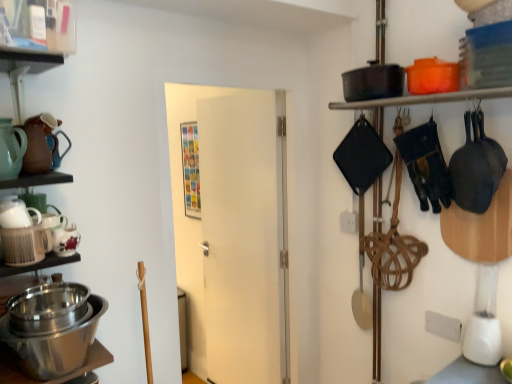
Describe the element at coordinates (425, 99) in the screenshot. Image resolution: width=512 pixels, height=384 pixels. I see `matte black pot at upper right, which is counted as the 2th shelf, starting from the top` at that location.

Where is `white plastic blender at right`? The width and height of the screenshot is (512, 384). white plastic blender at right is located at coordinates (484, 320).

Image resolution: width=512 pixels, height=384 pixels. What do you see at coordinates (232, 230) in the screenshot? I see `white matte door at center` at bounding box center [232, 230].

The width and height of the screenshot is (512, 384). What are the coordinates of `white matte door at center` in the screenshot? It's located at 232,230.

This screenshot has width=512, height=384. Describe the element at coordinates (11, 149) in the screenshot. I see `matte ceramic teapot at left, arranged as the 2th tea pot when viewed from the top` at that location.

You are a GUI agent. You are given a task and a screenshot of the screen. Output one action in this format:
    pyautogui.click(x=<x>, y=<y>)
    Task: Click on the ceramic tea pot at lower left, marked as the first tea pot in a bottom-to-top arrangement
    
    Given the screenshot: What is the action you would take?
    pyautogui.click(x=65, y=240)

From a real-world perspective, is clear plastic container at upper left, which is the 2th shelf in bottom-to-top order, physically located above or below ceramic tea pot at lower left, the 4th tea pot from the top?

clear plastic container at upper left, which is the 2th shelf in bottom-to-top order, is above ceramic tea pot at lower left, the 4th tea pot from the top.

This screenshot has height=384, width=512. I want to click on the 4th tea pot below the clear plastic container at upper left, the 1th shelf viewed from the left (from a real-world perspective), so click(x=65, y=240).

Looking at this image, which is correct: clear plastic container at upper left, arranged as the second shelf when viewed from the back, is inside ceramic tea pot at lower left, marked as the first tea pot in a bottom-to-top arrangement, or outside of it?

clear plastic container at upper left, arranged as the second shelf when viewed from the back, lies outside ceramic tea pot at lower left, marked as the first tea pot in a bottom-to-top arrangement.

Looking at this image, considering their positions, is clear plastic container at upper left, which ranks as the 2th shelf in right-to-left order, located in front of or behind ceramic tea pot at lower left, the 4th tea pot from the top?

clear plastic container at upper left, which ranks as the 2th shelf in right-to-left order, is positioned closer to the viewer than ceramic tea pot at lower left, the 4th tea pot from the top.

From the image's perspective, count 2nd tea pots downward from the matte brown teapot at upper left, which appears as the first tea pot when viewed from the top, and point to it. Please provide its 2D coordinates.

[(16, 213)]

Choose the correct answer: Is matte brown teapot at upper left, positioned as the 4th tea pot in bottom-to-top order, inside white matte tea pot at left, which appears as the 2th tea pot when ordered from the bottom, or outside it?

The correct answer is: outside.

Are matte brown teapot at upper left, which appears as the first tea pot when viewed from the top, and white matte tea pot at left, which ranks as the third tea pot in top-to-bottom order, located far from each other?

Actually, matte brown teapot at upper left, which appears as the first tea pot when viewed from the top, and white matte tea pot at left, which ranks as the third tea pot in top-to-bottom order, are a little close together.

From a real-world perspective, is matte brown teapot at upper left, positioned as the 4th tea pot in bottom-to-top order, beneath white matte tea pot at left, which appears as the 2th tea pot when ordered from the bottom?

No, from a real-world perspective, matte brown teapot at upper left, positioned as the 4th tea pot in bottom-to-top order, is not beneath white matte tea pot at left, which appears as the 2th tea pot when ordered from the bottom.

Is white matte tea pot at left, which ranks as the third tea pot in top-to-bottom order, oriented towards matte brown teapot at upper left, positioned as the 4th tea pot in bottom-to-top order?

No, white matte tea pot at left, which ranks as the third tea pot in top-to-bottom order, is not facing towards matte brown teapot at upper left, positioned as the 4th tea pot in bottom-to-top order.

Is white matte tea pot at left, which ranks as the third tea pot in top-to-bottom order, beside matte brown teapot at upper left, positioned as the 4th tea pot in bottom-to-top order?

No, white matte tea pot at left, which ranks as the third tea pot in top-to-bottom order, is not beside matte brown teapot at upper left, positioned as the 4th tea pot in bottom-to-top order.

Is white matte tea pot at left, which ranks as the third tea pot in top-to-bottom order, further to the viewer compared to matte brown teapot at upper left, which appears as the first tea pot when viewed from the top?

No, the depth of white matte tea pot at left, which ranks as the third tea pot in top-to-bottom order, is less than that of matte brown teapot at upper left, which appears as the first tea pot when viewed from the top.

In the scene shown: Considering the sizes of objects ceramic tea pot at lower left, marked as the first tea pot in a bottom-to-top arrangement, and matte black pot at upper right, which is counted as the first shelf, starting from the right, in the image provided, who is taller, ceramic tea pot at lower left, marked as the first tea pot in a bottom-to-top arrangement, or matte black pot at upper right, which is counted as the first shelf, starting from the right,?

ceramic tea pot at lower left, marked as the first tea pot in a bottom-to-top arrangement, is taller.

Considering the sizes of objects ceramic tea pot at lower left, the 4th tea pot from the top, and matte black pot at upper right, which is counted as the first shelf, starting from the right, in the image provided, who is smaller, ceramic tea pot at lower left, the 4th tea pot from the top, or matte black pot at upper right, which is counted as the first shelf, starting from the right,?

Smaller between the two is ceramic tea pot at lower left, the 4th tea pot from the top.

Is ceramic tea pot at lower left, the 4th tea pot from the top, not near matte black pot at upper right, which ranks as the 1th shelf in back-to-front order?

Indeed, ceramic tea pot at lower left, the 4th tea pot from the top, is not near matte black pot at upper right, which ranks as the 1th shelf in back-to-front order.

Which is closer to the camera, (56, 241) or (455, 92)?

Point (56, 241).

Is white matte door at center with clear plastic container at upper left, which is the 2th shelf in bottom-to-top order?

white matte door at center is not next to clear plastic container at upper left, which is the 2th shelf in bottom-to-top order, and they're not touching.

Does white matte door at center turn towards clear plastic container at upper left, arranged as the second shelf when viewed from the back?

No.

From the image's perspective, is white matte door at center above or below clear plastic container at upper left, the 1th shelf viewed from the left?

From the image's perspective, white matte door at center appears below clear plastic container at upper left, the 1th shelf viewed from the left.

Between point (271, 163) and point (68, 6), which one is positioned behind?

Point (271, 163)

From a real-world perspective, between white plastic blender at right and white matte door at center, who is vertically higher?

white matte door at center is physically above.

Consider the image. Considering the relative sizes of white plastic blender at right and white matte door at center in the image provided, is white plastic blender at right shorter than white matte door at center?

Correct, white plastic blender at right is not as tall as white matte door at center.

How far apart are white plastic blender at right and white matte door at center?

white plastic blender at right is 1.45 meters away from white matte door at center.

Is white plastic blender at right next to white matte door at center and touching it?

No, white plastic blender at right is not with white matte door at center.

Between ceramic tea pot at lower left, the 4th tea pot from the top, and matte ceramic teapot at left, arranged as the third tea pot when ordered from the bottom, which one is positioned in front?

matte ceramic teapot at left, arranged as the third tea pot when ordered from the bottom, is more forward.

Is ceramic tea pot at lower left, marked as the first tea pot in a bottom-to-top arrangement, aimed at matte ceramic teapot at left, arranged as the 2th tea pot when viewed from the top?

No, ceramic tea pot at lower left, marked as the first tea pot in a bottom-to-top arrangement, is not oriented towards matte ceramic teapot at left, arranged as the 2th tea pot when viewed from the top.

From a real-world perspective, between ceramic tea pot at lower left, marked as the first tea pot in a bottom-to-top arrangement, and matte ceramic teapot at left, arranged as the 2th tea pot when viewed from the top, who is vertically lower?

In real-world perspective, ceramic tea pot at lower left, marked as the first tea pot in a bottom-to-top arrangement, is lower.

Considering the relative sizes of ceramic tea pot at lower left, marked as the first tea pot in a bottom-to-top arrangement, and matte ceramic teapot at left, arranged as the 2th tea pot when viewed from the top, in the image provided, is ceramic tea pot at lower left, marked as the first tea pot in a bottom-to-top arrangement, smaller than matte ceramic teapot at left, arranged as the 2th tea pot when viewed from the top,?

Indeed, ceramic tea pot at lower left, marked as the first tea pot in a bottom-to-top arrangement, has a smaller size compared to matte ceramic teapot at left, arranged as the 2th tea pot when viewed from the top.

The width and height of the screenshot is (512, 384). What are the coordinates of `the 4th tea pot below the clear plastic container at upper left, which is the 2th shelf in bottom-to-top order (from the image's perspective)` in the screenshot? It's located at (65, 240).

Where is `tea pot that is the 1st one when counting leftward from the matte brown teapot at upper left, which appears as the first tea pot when viewed from the top`? tea pot that is the 1st one when counting leftward from the matte brown teapot at upper left, which appears as the first tea pot when viewed from the top is located at coordinates (16, 213).

Based on their spatial positions, is matte brown teapot at upper left, which appears as the first tea pot when viewed from the top, or matte ceramic teapot at left, arranged as the third tea pot when ordered from the bottom, closer to white matte door at center?

Based on the image, matte brown teapot at upper left, which appears as the first tea pot when viewed from the top, appears to be nearer to white matte door at center.

Estimate the real-world distances between objects in this image. Which object is further from stainless steel bowls at lower left, ceramic tea pot at lower left, the 4th tea pot from the top, or white plastic blender at right?

white plastic blender at right is further to stainless steel bowls at lower left.

Looking at the image, which one is located further to matte ceramic teapot at left, arranged as the third tea pot when ordered from the bottom, stainless steel bowls at lower left or matte black pot at upper right, positioned as the second shelf in front-to-back order?

matte black pot at upper right, positioned as the second shelf in front-to-back order, is further to matte ceramic teapot at left, arranged as the third tea pot when ordered from the bottom.

Based on the photo, when comparing their distances from matte brown teapot at upper left, positioned as the 4th tea pot in bottom-to-top order, does white matte door at center or clear plastic container at upper left, arranged as the second shelf when viewed from the back, seem further?

Based on the image, white matte door at center appears to be further to matte brown teapot at upper left, positioned as the 4th tea pot in bottom-to-top order.

Estimate the real-world distances between objects in this image. Which object is further from stainless steel bowls at lower left, matte black pot at upper right, which is counted as the first shelf, starting from the right, or clear plastic container at upper left, which ranks as the 2th shelf in right-to-left order?

The object further to stainless steel bowls at lower left is matte black pot at upper right, which is counted as the first shelf, starting from the right.

Estimate the real-world distances between objects in this image. Which object is further from matte brown teapot at upper left, positioned as the 4th tea pot in bottom-to-top order, white matte door at center or white matte tea pot at left, which appears as the 2th tea pot when ordered from the bottom?

Based on the image, white matte door at center appears to be further to matte brown teapot at upper left, positioned as the 4th tea pot in bottom-to-top order.

Considering their positions, is matte black pot at upper right, marked as the second shelf in a left-to-right arrangement, positioned closer to white matte tea pot at left, which appears as the 2th tea pot when ordered from the bottom, than stainless steel bowls at lower left?

Among the two, stainless steel bowls at lower left is located nearer to white matte tea pot at left, which appears as the 2th tea pot when ordered from the bottom.

Considering their positions, is white matte door at center positioned further to matte ceramic teapot at left, arranged as the 2th tea pot when viewed from the top, than clear plastic container at upper left, which ranks as the 2th shelf in right-to-left order?

Answer: The object further to matte ceramic teapot at left, arranged as the 2th tea pot when viewed from the top, is white matte door at center.

Find the location of `tea pot between clear plastic container at upper left, acting as the 1th shelf starting from the front, and matte black pot at upper right, positioned as the second shelf in front-to-back order`. tea pot between clear plastic container at upper left, acting as the 1th shelf starting from the front, and matte black pot at upper right, positioned as the second shelf in front-to-back order is located at coordinates (65, 240).

You are a GUI agent. You are given a task and a screenshot of the screen. Output one action in this format:
    pyautogui.click(x=<x>, y=<y>)
    Task: Click on the appliance between matte ceramic teapot at left, arranged as the 2th tea pot when viewed from the top, and matte black pot at upper right, which is counted as the 2th shelf, starting from the top, from left to right
    This screenshot has height=384, width=512.
    Given the screenshot: What is the action you would take?
    pyautogui.click(x=55, y=334)

Find the location of a particular element. Image resolution: width=512 pixels, height=384 pixels. tea pot between matte ceramic teapot at left, arranged as the 2th tea pot when viewed from the top, and ceramic tea pot at lower left, the 4th tea pot from the top, in the up-down direction is located at coordinates (16, 213).

You are a GUI agent. You are given a task and a screenshot of the screen. Output one action in this format:
    pyautogui.click(x=<x>, y=<y>)
    Task: Click on the door between stainless steel bowls at lower left and matte black pot at upper right, the first shelf in the bottom-to-top sequence, in the horizontal direction
    
    Given the screenshot: What is the action you would take?
    pyautogui.click(x=232, y=230)